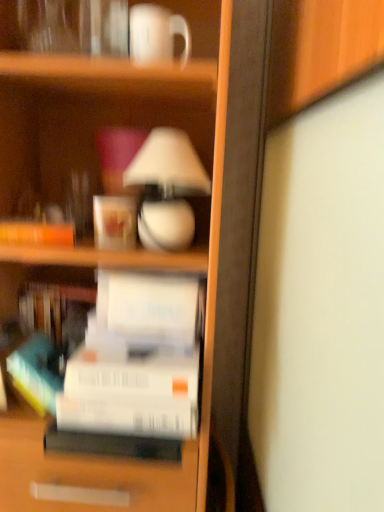
How much space does white matte paperback book at center, which appears as the 2th paperback book when viewed from the top, occupy vertically?

white matte paperback book at center, which appears as the 2th paperback book when viewed from the top, is 6.12 inches in height.

Where is `white matte paperback book at center, which appears as the 2th paperback book when viewed from the top`? Image resolution: width=384 pixels, height=512 pixels. white matte paperback book at center, which appears as the 2th paperback book when viewed from the top is located at coordinates (130, 394).

Does white glossy lamp at upper center have a larger size compared to white glossy mug at upper center, which is the 2th coffee cup in left-to-right order?

Yes.

Which is more to the right, white glossy lamp at upper center or white glossy mug at upper center, the first coffee cup viewed from the front?

From the viewer's perspective, white glossy lamp at upper center appears more on the right side.

Is white glossy lamp at upper center oriented away from white glossy mug at upper center, which is counted as the first coffee cup, starting from the top?

No.

Can you see white glossy lamp at upper center touching white glossy mug at upper center, which is counted as the first coffee cup, starting from the top?

white glossy lamp at upper center and white glossy mug at upper center, which is counted as the first coffee cup, starting from the top, are clearly separated.

Is matte white coffee cup at upper center, which is the first coffee cup from left to right, facing away from white glossy mug at upper center, which is the 2th coffee cup in left-to-right order?

No, matte white coffee cup at upper center, which is the first coffee cup from left to right, is not facing away from white glossy mug at upper center, which is the 2th coffee cup in left-to-right order.

Based on the photo, is there a large distance between matte white coffee cup at upper center, which is the first coffee cup from left to right, and white glossy mug at upper center, which is counted as the first coffee cup, starting from the top?

They are positioned close to each other.

From a real-world perspective, is matte white coffee cup at upper center, the 2th coffee cup when ordered from top to bottom, over white glossy mug at upper center, which is counted as the first coffee cup, starting from the top?

No, from a real-world perspective, matte white coffee cup at upper center, the 2th coffee cup when ordered from top to bottom, is not above white glossy mug at upper center, which is counted as the first coffee cup, starting from the top.

Is white glossy mug at upper center, marked as the second coffee cup in a bottom-to-top arrangement, located within matte white coffee cup at upper center, which appears as the 1th coffee cup when ordered from the bottom?

No, white glossy mug at upper center, marked as the second coffee cup in a bottom-to-top arrangement, is located outside of matte white coffee cup at upper center, which appears as the 1th coffee cup when ordered from the bottom.

Is white matte paperback book at center, the first paperback book in the bottom-to-top sequence, outside of matte white coffee cup at upper center, the 2th coffee cup in the front-to-back sequence?

Yes.

Considering the sizes of objects white matte paperback book at center, which appears as the 2th paperback book when viewed from the top, and matte white coffee cup at upper center, marked as the 1th coffee cup in a back-to-front arrangement, in the image provided, who is wider, white matte paperback book at center, which appears as the 2th paperback book when viewed from the top, or matte white coffee cup at upper center, marked as the 1th coffee cup in a back-to-front arrangement,?

With larger width is white matte paperback book at center, which appears as the 2th paperback book when viewed from the top.

Between white matte paperback book at center, the first paperback book in the bottom-to-top sequence, and matte white coffee cup at upper center, marked as the 1th coffee cup in a back-to-front arrangement, which one has more height?

white matte paperback book at center, the first paperback book in the bottom-to-top sequence, is taller.

How different are the orientations of white matte paperback book at center, which appears as the 2th paperback book when viewed from the top, and matte white coffee cup at upper center, which appears as the 1th coffee cup when ordered from the bottom, in degrees?

0.00412 degrees.

From the image's perspective, does white matte paperback book at center, which appears as the 2th paperback book when viewed from the top, appear higher than white matte paper at center, the 2th paperback book in the bottom-to-top sequence?

No, from the image's perspective, white matte paperback book at center, which appears as the 2th paperback book when viewed from the top, is not on top of white matte paper at center, the 2th paperback book in the bottom-to-top sequence.

From the picture: Looking at the image, does white matte paperback book at center, which appears as the 2th paperback book when viewed from the top, seem bigger or smaller compared to white matte paper at center, which appears as the first paperback book when viewed from the top?

In the image, white matte paperback book at center, which appears as the 2th paperback book when viewed from the top, appears to be larger than white matte paper at center, which appears as the first paperback book when viewed from the top.

Are white matte paperback book at center, which appears as the 2th paperback book when viewed from the top, and white matte paper at center, which appears as the first paperback book when viewed from the top, far apart?

No, white matte paperback book at center, which appears as the 2th paperback book when viewed from the top, is not far from white matte paper at center, which appears as the first paperback book when viewed from the top.

Is point (106, 355) closer or farther from the camera than point (162, 333)?

Point (106, 355).

From the image's perspective, is white matte paper at center, the 2th paperback book in the bottom-to-top sequence, under white glossy mug at upper center, which is the 2th coffee cup in left-to-right order?

Yes.

Is white glossy mug at upper center, the first coffee cup viewed from the front, completely or partially inside white matte paper at center, which appears as the first paperback book when viewed from the top?

No, white glossy mug at upper center, the first coffee cup viewed from the front, is not surrounded by white matte paper at center, which appears as the first paperback book when viewed from the top.

From a real-world perspective, is white matte paper at center, which appears as the first paperback book when viewed from the top, below white glossy mug at upper center, which is the 2th coffee cup in left-to-right order?

Indeed, from a real-world perspective, white matte paper at center, which appears as the first paperback book when viewed from the top, is positioned beneath white glossy mug at upper center, which is the 2th coffee cup in left-to-right order.

Where is `the 1st paperback book directly beneath the white glossy mug at upper center, the first coffee cup viewed from the front (from a real-world perspective)`? the 1st paperback book directly beneath the white glossy mug at upper center, the first coffee cup viewed from the front (from a real-world perspective) is located at coordinates (149, 307).

Which is correct: white matte paper at center, the 2th paperback book in the bottom-to-top sequence, is inside white matte paperback book at center, which appears as the 2th paperback book when viewed from the top, or outside of it?

white matte paper at center, the 2th paperback book in the bottom-to-top sequence, cannot be found inside white matte paperback book at center, which appears as the 2th paperback book when viewed from the top.

Is white matte paper at center, the 2th paperback book in the bottom-to-top sequence, in front of or behind white matte paperback book at center, the first paperback book in the bottom-to-top sequence, in the image?

white matte paper at center, the 2th paperback book in the bottom-to-top sequence, is behind white matte paperback book at center, the first paperback book in the bottom-to-top sequence.

Does point (104, 328) appear closer or farther from the camera than point (140, 376)?

Point (104, 328) appears to be farther away from the viewer than point (140, 376).

Can you confirm if white matte paper at center, which appears as the first paperback book when viewed from the top, is positioned to the left of white matte paperback book at center, which appears as the 2th paperback book when viewed from the top?

No, white matte paper at center, which appears as the first paperback book when viewed from the top, is not to the left of white matte paperback book at center, which appears as the 2th paperback book when viewed from the top.

Considering the relative positions of white glossy mug at upper center, the first coffee cup viewed from the front, and matte white coffee cup at upper center, the 2th coffee cup in the front-to-back sequence, in the image provided, is white glossy mug at upper center, the first coffee cup viewed from the front, to the left or to the right of matte white coffee cup at upper center, the 2th coffee cup in the front-to-back sequence,?

From the image, it's evident that white glossy mug at upper center, the first coffee cup viewed from the front, is to the right of matte white coffee cup at upper center, the 2th coffee cup in the front-to-back sequence.

Is white glossy mug at upper center, the first coffee cup viewed from the front, spatially inside matte white coffee cup at upper center, which is the first coffee cup from left to right, or outside of it?

white glossy mug at upper center, the first coffee cup viewed from the front, is not inside matte white coffee cup at upper center, which is the first coffee cup from left to right, it's outside.

From a real-world perspective, is white glossy mug at upper center, which is the 2th coffee cup in left-to-right order, on matte white coffee cup at upper center, arranged as the 2th coffee cup when viewed from the right?

Correct, in the physical world, white glossy mug at upper center, which is the 2th coffee cup in left-to-right order, is higher than matte white coffee cup at upper center, arranged as the 2th coffee cup when viewed from the right.

Is white glossy mug at upper center, which is the second coffee cup from back to front, touching matte white coffee cup at upper center, the 2th coffee cup when ordered from top to bottom?

No, white glossy mug at upper center, which is the second coffee cup from back to front, is not making contact with matte white coffee cup at upper center, the 2th coffee cup when ordered from top to bottom.

Locate an element on the screen. This screenshot has height=512, width=384. coffee cup in front of the white glossy lamp at upper center is located at coordinates (156, 34).

Identify the location of coffee cup above the matte white coffee cup at upper center, the 2th coffee cup in the front-to-back sequence (from a real-world perspective). The height and width of the screenshot is (512, 384). (156, 34).

Estimate the real-world distances between objects in this image. Which object is closer to matte white coffee cup at upper center, arranged as the 2th coffee cup when viewed from the right, white matte paper at center, which appears as the first paperback book when viewed from the top, or white matte paperback book at center, the first paperback book in the bottom-to-top sequence?

white matte paper at center, which appears as the first paperback book when viewed from the top, is positioned closer to the anchor matte white coffee cup at upper center, arranged as the 2th coffee cup when viewed from the right.

Looking at the image, which one is located further to matte white coffee cup at upper center, which is the first coffee cup from left to right, white glossy lamp at upper center or white matte paperback book at center, the first paperback book in the bottom-to-top sequence?

Based on the image, white matte paperback book at center, the first paperback book in the bottom-to-top sequence, appears to be further to matte white coffee cup at upper center, which is the first coffee cup from left to right.

Looking at the image, which one is located further to white glossy mug at upper center, which appears as the first coffee cup when viewed from the right, matte white coffee cup at upper center, which appears as the 1th coffee cup when ordered from the bottom, or white matte paperback book at center, which appears as the 2th paperback book when viewed from the top?

Among the two, white matte paperback book at center, which appears as the 2th paperback book when viewed from the top, is located further to white glossy mug at upper center, which appears as the first coffee cup when viewed from the right.

Considering their positions, is white matte paperback book at center, the first paperback book in the bottom-to-top sequence, positioned further to white glossy mug at upper center, which appears as the first coffee cup when viewed from the right, than matte white coffee cup at upper center, which appears as the 1th coffee cup when ordered from the bottom?

Based on the image, white matte paperback book at center, the first paperback book in the bottom-to-top sequence, appears to be further to white glossy mug at upper center, which appears as the first coffee cup when viewed from the right.

Which object lies nearer to the anchor point white matte paperback book at center, the first paperback book in the bottom-to-top sequence, white matte paper at center, which appears as the first paperback book when viewed from the top, or white glossy mug at upper center, which is the second coffee cup from back to front?

Among the two, white matte paper at center, which appears as the first paperback book when viewed from the top, is located nearer to white matte paperback book at center, the first paperback book in the bottom-to-top sequence.

Which object lies further to the anchor point white glossy lamp at upper center, matte white coffee cup at upper center, marked as the 1th coffee cup in a back-to-front arrangement, or white matte paperback book at center, the first paperback book in the bottom-to-top sequence?

The object further to white glossy lamp at upper center is white matte paperback book at center, the first paperback book in the bottom-to-top sequence.

Which object lies nearer to the anchor point matte white coffee cup at upper center, marked as the 1th coffee cup in a back-to-front arrangement, white glossy mug at upper center, marked as the second coffee cup in a bottom-to-top arrangement, or white matte paper at center, the 2th paperback book in the bottom-to-top sequence?

Based on the image, white matte paper at center, the 2th paperback book in the bottom-to-top sequence, appears to be nearer to matte white coffee cup at upper center, marked as the 1th coffee cup in a back-to-front arrangement.

Looking at the image, which one is located further to matte white coffee cup at upper center, arranged as the 2th coffee cup when viewed from the right, white glossy lamp at upper center or white matte paper at center, which appears as the first paperback book when viewed from the top?

The object further to matte white coffee cup at upper center, arranged as the 2th coffee cup when viewed from the right, is white matte paper at center, which appears as the first paperback book when viewed from the top.

Locate an element on the screen. This screenshot has width=384, height=512. lamp between white glossy mug at upper center, which appears as the first coffee cup when viewed from the right, and white matte paperback book at center, the first paperback book in the bottom-to-top sequence, in the vertical direction is located at coordinates (167, 188).

This screenshot has width=384, height=512. What are the coordinates of `lamp between white glossy mug at upper center, which is counted as the first coffee cup, starting from the top, and white matte paper at center, the 2th paperback book in the bottom-to-top sequence, vertically` in the screenshot? It's located at (167, 188).

The image size is (384, 512). Identify the location of paperback book between matte white coffee cup at upper center, arranged as the 2th coffee cup when viewed from the right, and white matte paperback book at center, which appears as the 2th paperback book when viewed from the top, vertically. (149, 307).

Locate an element on the screen. The width and height of the screenshot is (384, 512). lamp between white glossy mug at upper center, which is counted as the first coffee cup, starting from the top, and matte white coffee cup at upper center, arranged as the 2th coffee cup when viewed from the right, vertically is located at coordinates (167, 188).